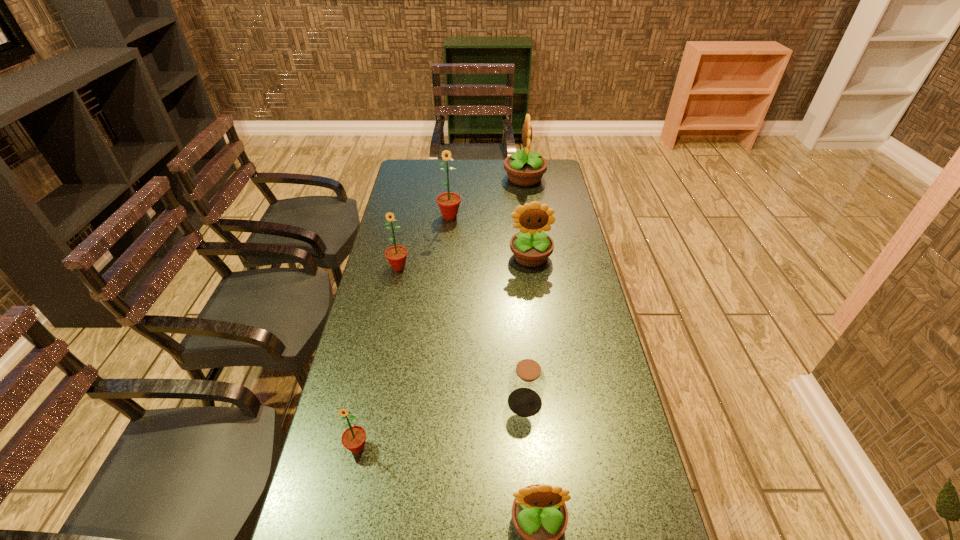
Locate an element on the screen. The image size is (960, 540). the farthest sunflower is located at coordinates (525, 168).

Where is `the farthest object`? The width and height of the screenshot is (960, 540). the farthest object is located at coordinates (525, 168).

At what (x,y) coordinates should I click in order to perform the action: click on the fifth object from right to left. Please return your answer as a coordinate pair (x, y). The image size is (960, 540). Looking at the image, I should click on (449, 202).

Find the location of `the third sunflower from left to right`. the third sunflower from left to right is located at coordinates (449, 202).

What are the coordinates of `the second smallest yellow sunflower` in the screenshot? It's located at (531, 247).

Where is `the second farthest green sunflower`? the second farthest green sunflower is located at coordinates (396, 255).

Where is `the nearest green sunflower`? Image resolution: width=960 pixels, height=540 pixels. the nearest green sunflower is located at coordinates (353, 438).

The image size is (960, 540). Find the location of `the smallest green sunflower`. the smallest green sunflower is located at coordinates (353, 438).

Locate an element on the screen. This screenshot has height=540, width=960. the shortest object is located at coordinates (527, 381).

Locate an element on the screen. the third nearest object is located at coordinates (527, 381).